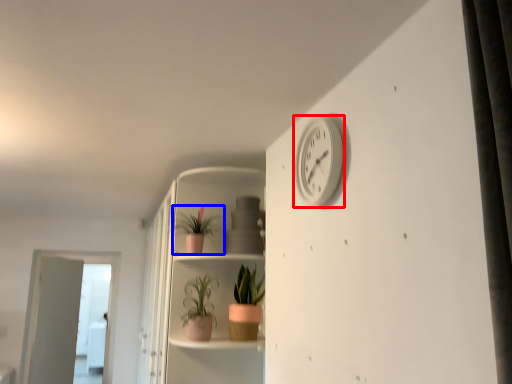
Question: Which object appears farthest to the camera in this image, clock (highlighted by a red box) or houseplant (highlighted by a blue box)?

Choices:
 (A) clock
 (B) houseplant

Answer: (B)